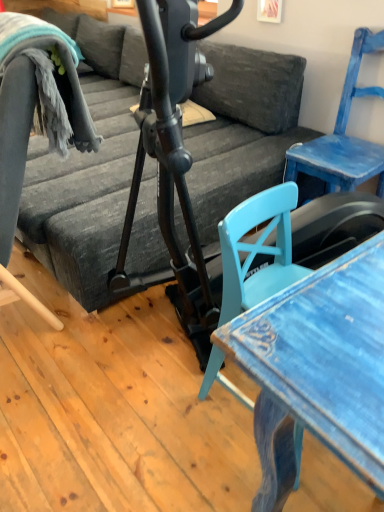
Question: In terms of height, does distressed blue table at lower right look taller or shorter compared to dark gray fabric couch at center?

Choices:
 (A) tall
 (B) short

Answer: (B)

Question: In the image, is distressed blue table at lower right positioned in front of or behind dark gray fabric couch at center?

Choices:
 (A) front
 (B) behind

Answer: (A)

Question: Which object is positioned closest to the blue painted wood chair at right?

Choices:
 (A) distressed blue table at lower right
 (B) dark gray fabric couch at center

Answer: (B)

Question: Which is farther from the blue painted wood chair at right?

Choices:
 (A) distressed blue table at lower right
 (B) dark gray fabric couch at center

Answer: (A)